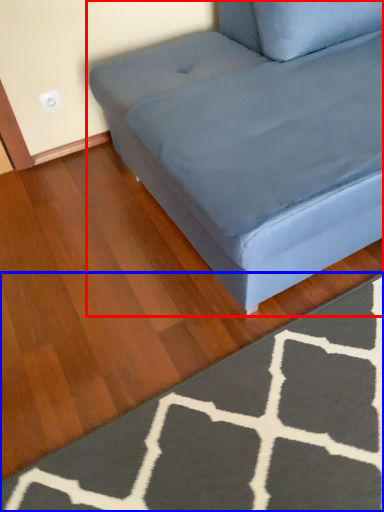
Question: Among these objects, which one is nearest to the camera, studio couch (highlighted by a red box) or doormat (highlighted by a blue box)?

Choices:
 (A) studio couch
 (B) doormat

Answer: (A)